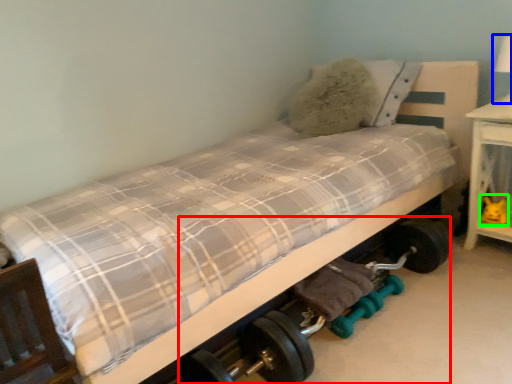
Question: Considering the real-world distances, which object is closest to baby carriage (highlighted by a red box)? table lamp (highlighted by a blue box) or toy (highlighted by a green box).

Choices:
 (A) table lamp
 (B) toy

Answer: (B)